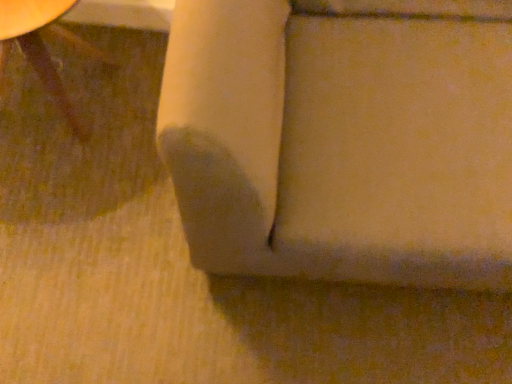
Question: From the image's perspective, does matte brown wood table at lower left, placed as the 1th furniture when sorted from left to right, appear lower than matte beige cushion at center, positioned as the first furniture in right-to-left order?

Choices:
 (A) no
 (B) yes

Answer: (A)

Question: Is matte brown wood table at lower left, placed as the second furniture when sorted from right to left, further to camera compared to matte beige cushion at center, the second furniture in the left-to-right sequence?

Choices:
 (A) yes
 (B) no

Answer: (A)

Question: From the image's perspective, is matte brown wood table at lower left, placed as the second furniture when sorted from right to left, above matte beige cushion at center, positioned as the first furniture in right-to-left order?

Choices:
 (A) yes
 (B) no

Answer: (A)

Question: Is the position of matte brown wood table at lower left, placed as the second furniture when sorted from right to left, less distant than that of matte beige cushion at center, positioned as the first furniture in right-to-left order?

Choices:
 (A) no
 (B) yes

Answer: (A)

Question: Can you confirm if matte brown wood table at lower left, placed as the 1th furniture when sorted from left to right, is positioned to the left of matte beige cushion at center, positioned as the first furniture in right-to-left order?

Choices:
 (A) no
 (B) yes

Answer: (B)

Question: Is matte brown wood table at lower left, placed as the second furniture when sorted from right to left, at the right side of matte beige cushion at center, positioned as the first furniture in right-to-left order?

Choices:
 (A) no
 (B) yes

Answer: (A)

Question: From the image's perspective, is matte beige cushion at center, the second furniture in the left-to-right sequence, on matte brown wood table at lower left, placed as the second furniture when sorted from right to left?

Choices:
 (A) yes
 (B) no

Answer: (B)

Question: From the image's perspective, does matte beige cushion at center, the second furniture in the left-to-right sequence, appear lower than matte brown wood table at lower left, placed as the 1th furniture when sorted from left to right?

Choices:
 (A) no
 (B) yes

Answer: (B)

Question: From a real-world perspective, is matte beige cushion at center, the second furniture in the left-to-right sequence, below matte brown wood table at lower left, placed as the 1th furniture when sorted from left to right?

Choices:
 (A) no
 (B) yes

Answer: (A)

Question: Is matte beige cushion at center, the second furniture in the left-to-right sequence, aimed at matte brown wood table at lower left, placed as the 1th furniture when sorted from left to right?

Choices:
 (A) no
 (B) yes

Answer: (A)

Question: Is the position of matte beige cushion at center, the second furniture in the left-to-right sequence, less distant than that of matte brown wood table at lower left, placed as the second furniture when sorted from right to left?

Choices:
 (A) no
 (B) yes

Answer: (B)

Question: Can you confirm if matte beige cushion at center, positioned as the first furniture in right-to-left order, is thinner than matte brown wood table at lower left, placed as the 1th furniture when sorted from left to right?

Choices:
 (A) no
 (B) yes

Answer: (A)

Question: In terms of size, does matte beige cushion at center, the second furniture in the left-to-right sequence, appear bigger or smaller than matte brown wood table at lower left, placed as the 1th furniture when sorted from left to right?

Choices:
 (A) big
 (B) small

Answer: (A)